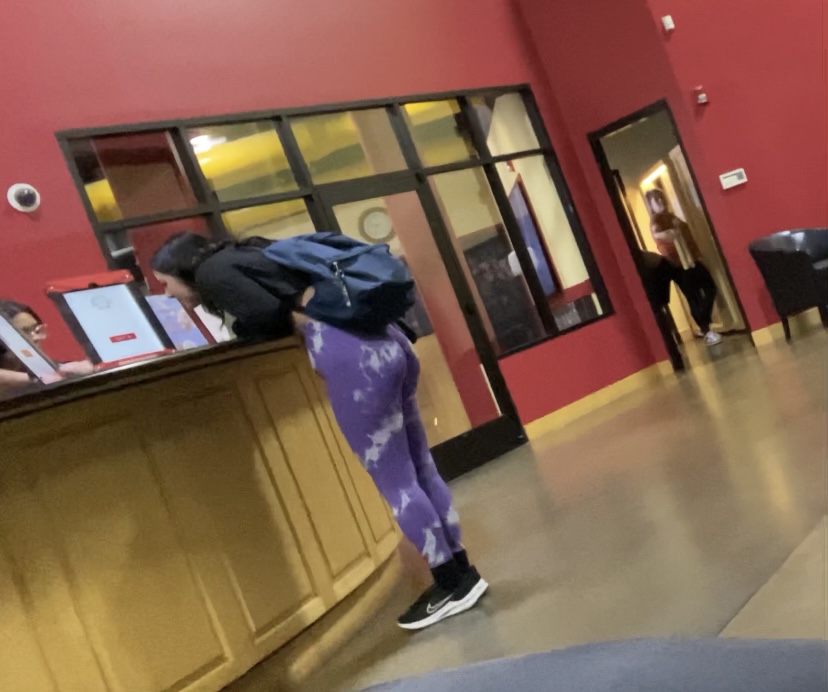
Where is `window`? The width and height of the screenshot is (828, 692). window is located at coordinates (513, 270).